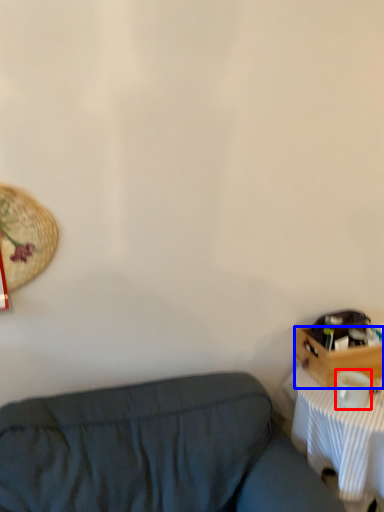
Question: Which object appears closest to the camera in this image, coffee cup (highlighted by a red box) or drawer (highlighted by a blue box)?

Choices:
 (A) coffee cup
 (B) drawer

Answer: (A)